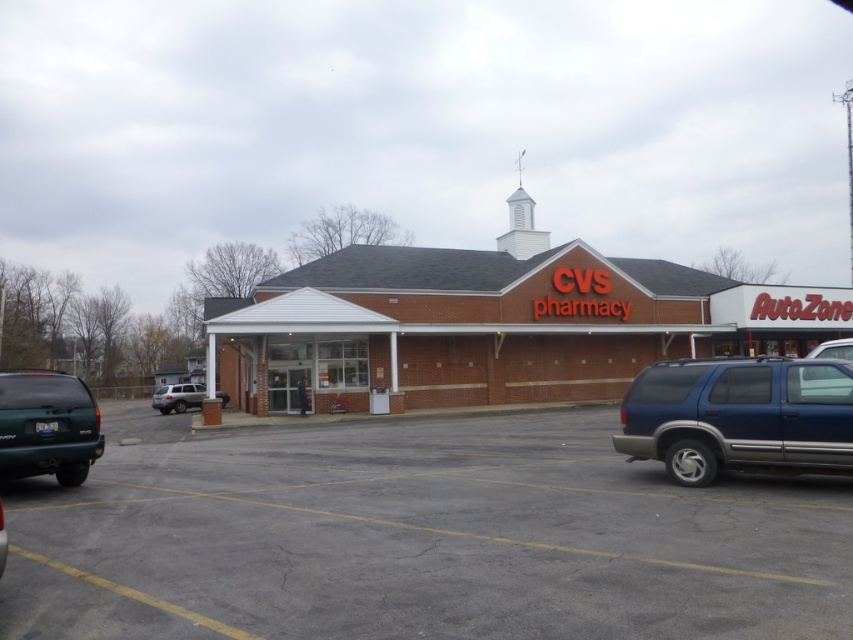
You are a delivery driver who needs to park your teal matte suv at lower left and satin silver suv at lower left in the parking lot. Since both SUVs are parked at the lower left, which one takes up less space in the parking lot?

The teal matte suv at lower left is smaller than the satin silver suv at lower left, so it takes up less space in the parking lot.